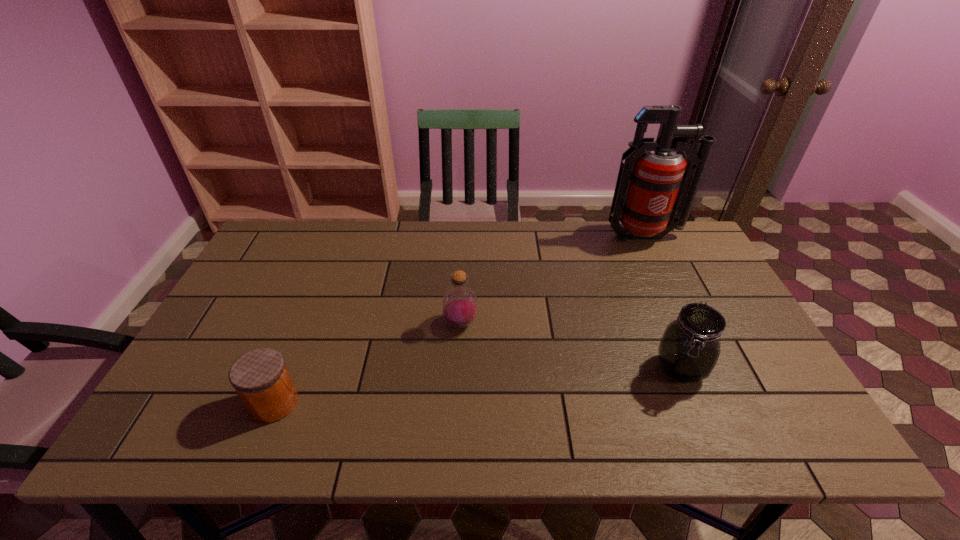
At what (x,y) coordinates should I click in order to perform the action: click on the tallest object. Please return your answer as a coordinate pair (x, y). The image size is (960, 540). Looking at the image, I should click on (655, 185).

Find the location of `the farthest object`. the farthest object is located at coordinates (655, 185).

The height and width of the screenshot is (540, 960). I want to click on the taller jar, so click(689, 349).

I want to click on the third nearest object, so click(x=459, y=305).

The height and width of the screenshot is (540, 960). I want to click on the second object from left to right, so click(x=459, y=305).

Where is `the leftmost object`? The width and height of the screenshot is (960, 540). the leftmost object is located at coordinates (260, 377).

What are the coordinates of `the shortest object` in the screenshot? It's located at (x=260, y=377).

Locate an element on the screen. Image resolution: width=960 pixels, height=540 pixels. vacant space situated 0.100m on the front label side of the fire extinguisher is located at coordinates (660, 269).

In order to click on free space located on the lid of the right jar in this screenshot , I will do `click(708, 434)`.

At what (x,y) coordinates should I click in order to perform the action: click on free space located 0.050m on the front of the bottle. Please return your answer as a coordinate pair (x, y). Looking at the image, I should click on tap(460, 352).